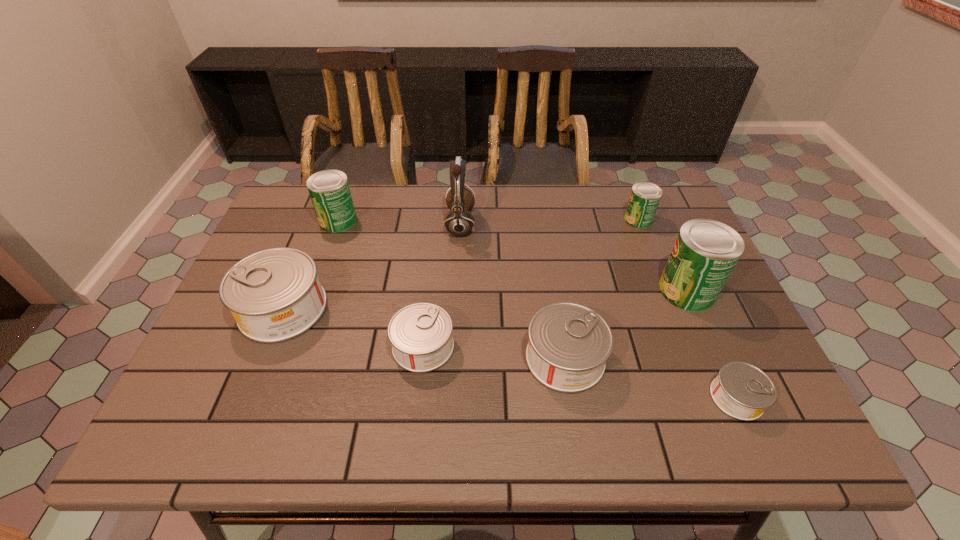
Identify which object is located as the fifth nearest to the leftmost green can. Please provide its 2D coordinates. Your answer should be formatted as a tuple, i.e. [(x, y)], where the tuple contains the x and y coordinates of a point satisfying the conditions above.

[(644, 199)]

Locate an element on the screen. The image size is (960, 540). the sixth closest can to the smallest silver can is located at coordinates (329, 190).

What are the coordinates of `can that can be found as the third closest to the biggest green can` in the screenshot? It's located at (569, 343).

Locate an element on the screen. green can that is the second nearest to the shortest object is located at coordinates (644, 199).

Identify which green can is located as the third nearest to the tallest object. Please provide its 2D coordinates. Your answer should be formatted as a tuple, i.e. [(x, y)], where the tuple contains the x and y coordinates of a point satisfying the conditions above.

[(706, 251)]

Identify which silver can is the second closest to the fifth can from right to left. Please provide its 2D coordinates. Your answer should be formatted as a tuple, i.e. [(x, y)], where the tuple contains the x and y coordinates of a point satisfying the conditions above.

[(275, 295)]

Find the location of a particular element. This screenshot has height=540, width=960. silver can object that ranks as the fourth closest to the biggest green can is located at coordinates (275, 295).

Locate an element on the screen. Image resolution: width=960 pixels, height=540 pixels. free space that satisfies the following two spatial constraints: 1. on the ear pads of the tallest can; 2. on the right side of the earphone is located at coordinates (457, 290).

This screenshot has width=960, height=540. Find the location of `free space in the image that satisfies the following two spatial constraints: 1. on the back side of the leftmost silver can; 2. on the left side of the smallest green can`. free space in the image that satisfies the following two spatial constraints: 1. on the back side of the leftmost silver can; 2. on the left side of the smallest green can is located at coordinates (319, 220).

Where is `vacant space that satisfies the following two spatial constraints: 1. on the back side of the smallest green can; 2. on the left side of the third can from left to right`? vacant space that satisfies the following two spatial constraints: 1. on the back side of the smallest green can; 2. on the left side of the third can from left to right is located at coordinates (437, 220).